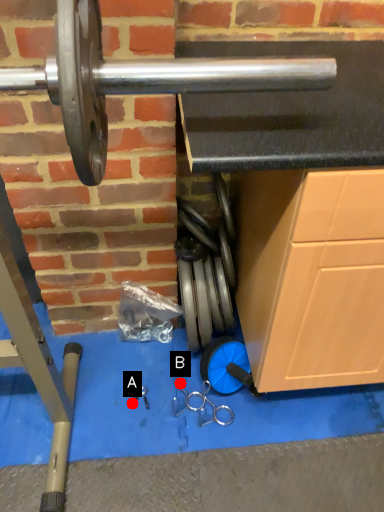
Question: Two points are circled on the image, labeled by A and B beside each circle. Which point is closer to the camera?

Choices:
 (A) A is closer
 (B) B is closer

Answer: (A)